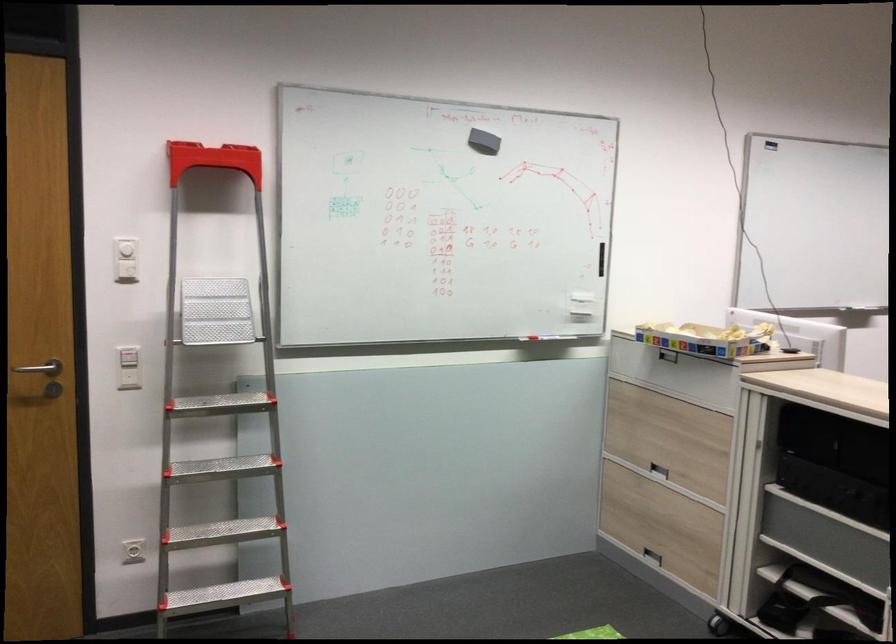
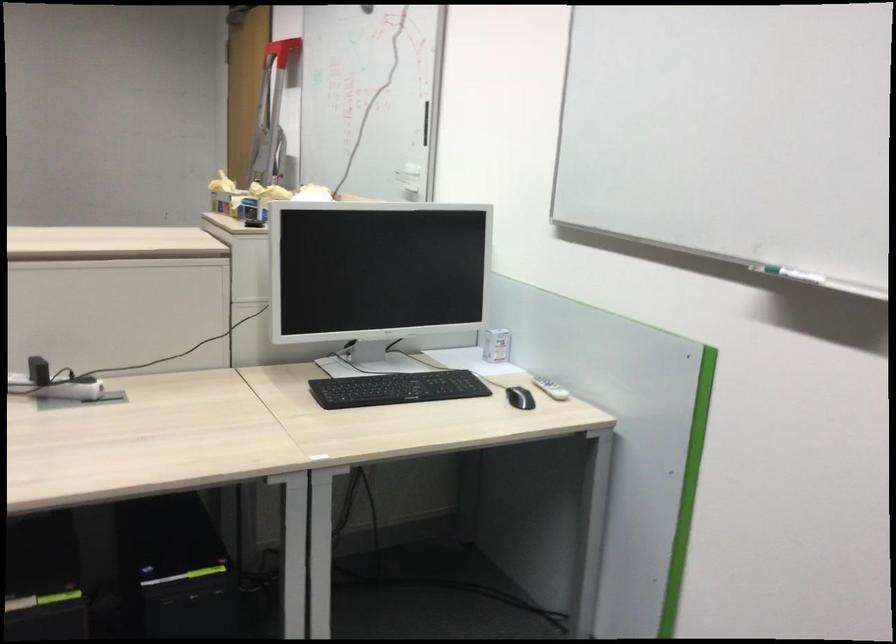
Question: I am providing you with two images of the same scene from different viewpoints. Please identify which objects are invisible in image2.

Choices:
 (A) black computer mouse
 (B) black square button
 (C) small white box
 (D) black bag strap

Answer: (D)